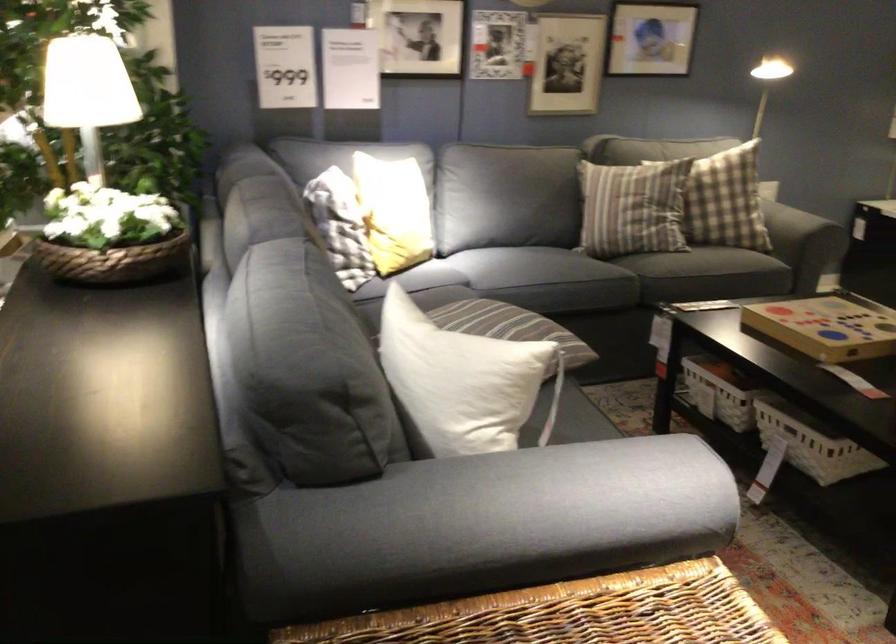
At what (x,y) coordinates should I click in order to perform the action: click on wooden game box. Please return your answer as a coordinate pair (x, y). The image size is (896, 644). Looking at the image, I should click on (828, 326).